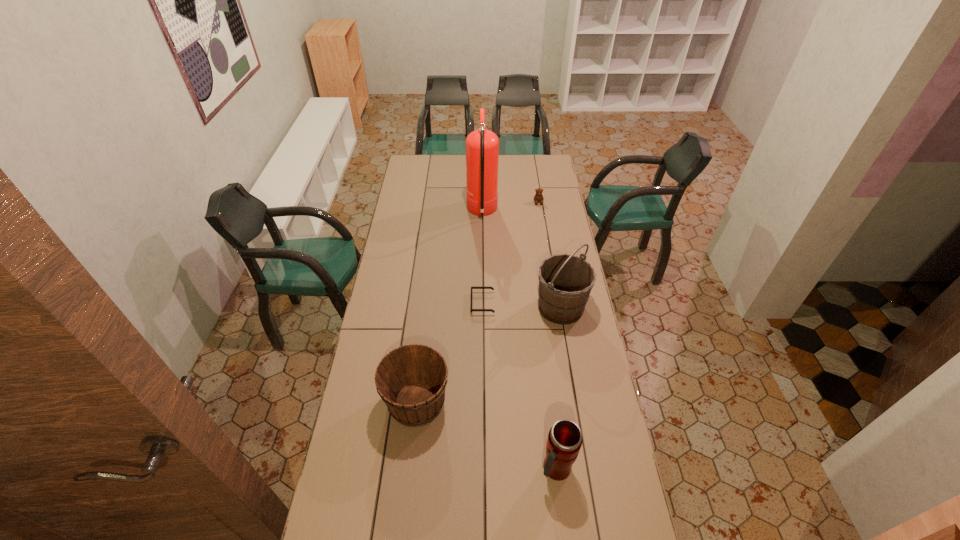
Where is `free space that satisfies the following two spatial constraints: 1. on the face of the teddy bear; 2. towards the nozzle of the tallest object`? The image size is (960, 540). free space that satisfies the following two spatial constraints: 1. on the face of the teddy bear; 2. towards the nozzle of the tallest object is located at coordinates (540, 212).

The width and height of the screenshot is (960, 540). I want to click on free space that satisfies the following two spatial constraints: 1. on the face of the teddy bear; 2. towards the nozzle of the tallest object, so click(x=540, y=212).

You are a GUI agent. You are given a task and a screenshot of the screen. Output one action in this format:
    pyautogui.click(x=<x>, y=<y>)
    Task: Click on the vacant space that satisfies the following two spatial constraints: 1. on the face of the second tallest object; 2. on the left side of the fifth tallest object
    The height and width of the screenshot is (540, 960).
    Given the screenshot: What is the action you would take?
    [555, 307]